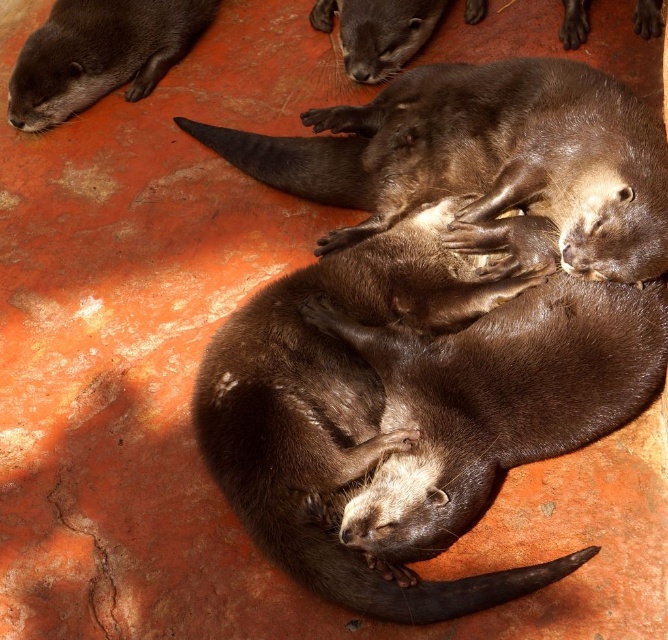
Question: Which is farther from the brown shiny otter at center?

Choices:
 (A) shiny brown otter at center
 (B) brown furry otter at center

Answer: (A)

Question: Can you confirm if brown shiny otter at center is positioned below shiny brown otter at upper left?

Choices:
 (A) yes
 (B) no

Answer: (A)

Question: Which object is positioned closest to the brown furry otter at center?

Choices:
 (A) shiny brown otter at center
 (B) shiny brown otter at upper left

Answer: (A)

Question: Which point is farther to the camera?

Choices:
 (A) (126, 10)
 (B) (391, 531)

Answer: (A)

Question: Is brown shiny otter at center bigger than shiny brown otter at upper left?

Choices:
 (A) no
 (B) yes

Answer: (B)

Question: Does shiny brown otter at center appear under shiny brown otter at upper left?

Choices:
 (A) no
 (B) yes

Answer: (B)